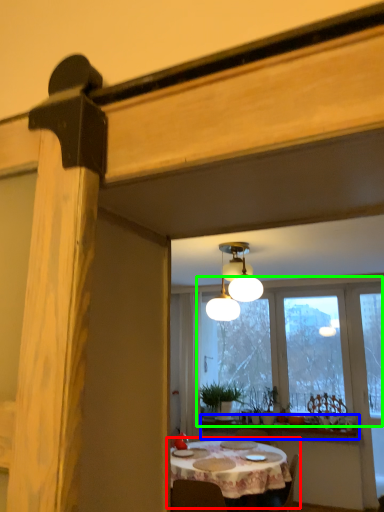
Question: Estimate the real-world distances between objects in this image. Which object is closer to kitchen & dining room table (highlighted by a red box), window sill (highlighted by a blue box) or window (highlighted by a green box)?

Choices:
 (A) window sill
 (B) window

Answer: (A)